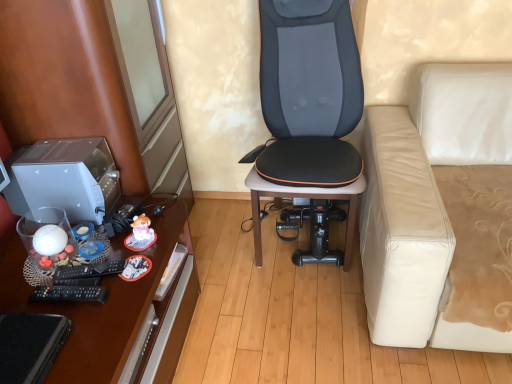
Identify the location of vacant area that is in front of black leather chair at center. This screenshot has width=512, height=384. (290, 317).